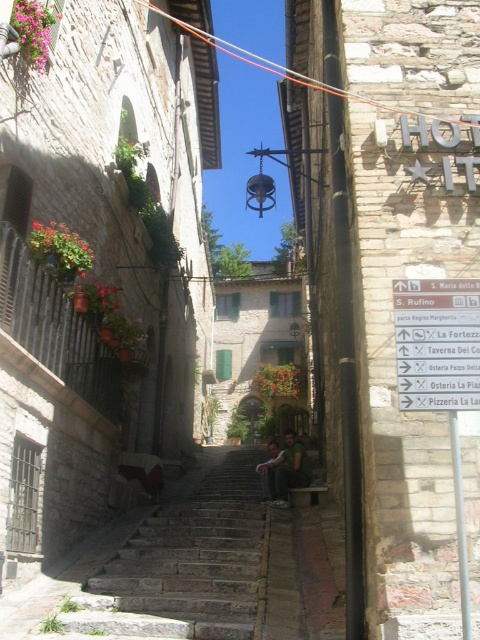
Question: Which object appears closest to the camera in this image?

Choices:
 (A) white plastic sign at center right
 (B) dark blue jeans at center
 (C) green fabric shirt at center

Answer: (A)

Question: Does white plastic sign at center right have a larger size compared to green fabric shirt at center?

Choices:
 (A) no
 (B) yes

Answer: (A)

Question: Which of the following is the closest to the observer?

Choices:
 (A) green fabric shirt at center
 (B) white plastic sign at center right
 (C) dark blue jeans at center

Answer: (B)

Question: Can you confirm if stone stairs at center is positioned above dark blue jeans at center?

Choices:
 (A) yes
 (B) no

Answer: (A)

Question: Based on their relative distances, which object is farther from the white plastic sign at center right?

Choices:
 (A) dark blue jeans at center
 (B) green fabric shirt at center
 (C) stone stairs at center

Answer: (A)

Question: Is white plastic sign at center right closer to camera compared to dark blue jeans at center?

Choices:
 (A) yes
 (B) no

Answer: (A)